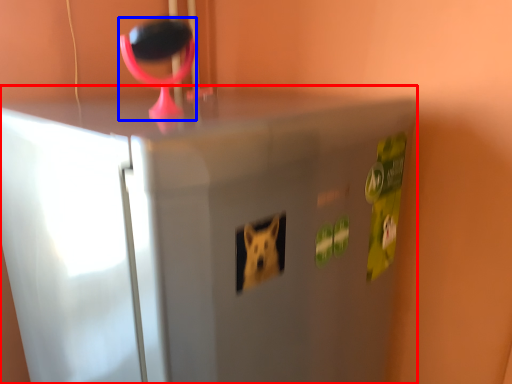
Question: Among these objects, which one is nearest to the camera, refrigerator (highlighted by a red box) or magnifying glass (highlighted by a blue box)?

Choices:
 (A) refrigerator
 (B) magnifying glass

Answer: (A)